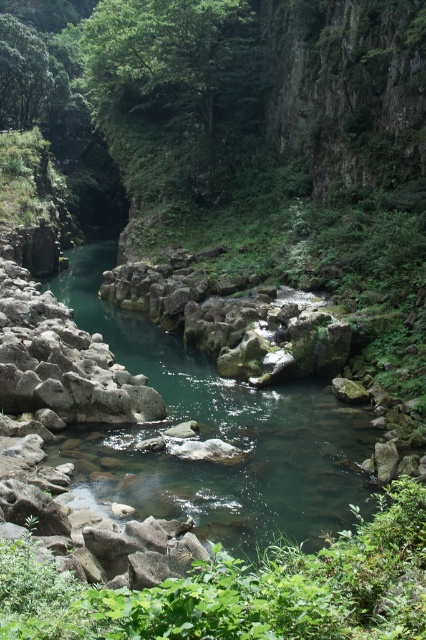
Question: Is green smooth water at center above green leafy shrubs at center?

Choices:
 (A) no
 (B) yes

Answer: (B)

Question: Can you confirm if green smooth water at center is bigger than green leafy shrubs at center?

Choices:
 (A) yes
 (B) no

Answer: (A)

Question: Where is green smooth water at center located in relation to green leafy shrubs at center in the image?

Choices:
 (A) right
 (B) left

Answer: (A)

Question: Which point appears closest to the camera in this image?

Choices:
 (A) (135, 320)
 (B) (63, 627)

Answer: (B)